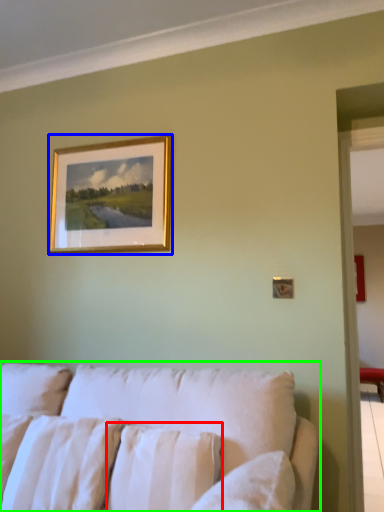
Question: Which object is positioned farthest from pillow (highlighted by a red box)? Select from picture frame (highlighted by a blue box) and studio couch (highlighted by a green box).

Choices:
 (A) picture frame
 (B) studio couch

Answer: (A)